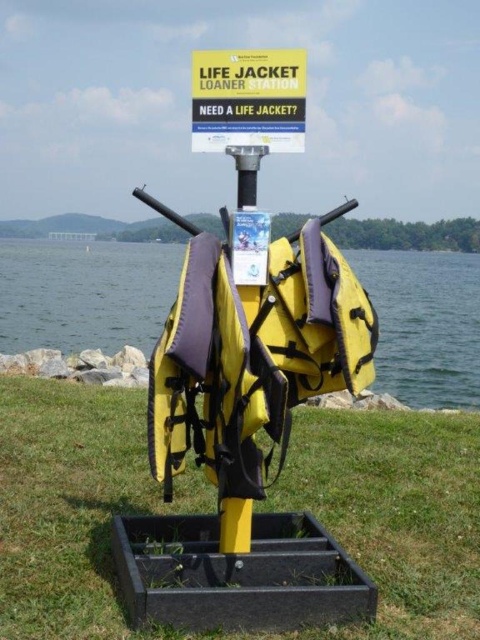
Question: Where is green grass at center located in relation to yellow fabric life jackets at center in the image?

Choices:
 (A) below
 (B) above

Answer: (A)

Question: Which point appears farthest from the camera in this image?

Choices:
 (A) (x=85, y=310)
 (B) (x=434, y=525)
 (C) (x=223, y=100)

Answer: (A)

Question: Is yellow fabric life jackets at center smaller than metallic pole at center?

Choices:
 (A) no
 (B) yes

Answer: (A)

Question: Which point is closer to the camera taking this photo?

Choices:
 (A) (99, 456)
 (B) (279, 118)
 (C) (251, 525)

Answer: (B)

Question: Does yellow fabric life jackets at center appear over metallic pole at center?

Choices:
 (A) yes
 (B) no

Answer: (A)

Question: Among these points, which one is nearest to the camera?

Choices:
 (A) (427, 392)
 (B) (303, 88)
 (C) (243, 152)
 (D) (169, 364)

Answer: (D)